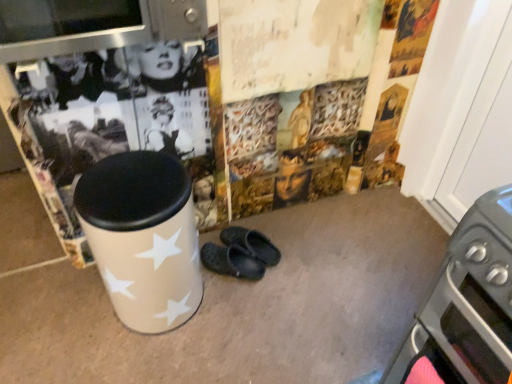
Question: From a real-world perspective, relative to white glossy trash can at center, is metallic gray oven at lower right vertically above or below?

Choices:
 (A) below
 (B) above

Answer: (B)

Question: From the image's perspective, is metallic gray oven at lower right located above or below white glossy trash can at center?

Choices:
 (A) above
 (B) below

Answer: (B)

Question: Based on their relative distances, which object is farther from the white glossy trash can at center?

Choices:
 (A) metallic stainless steel microwave at upper left
 (B) black rubber clogs at center
 (C) metallic gray oven at lower right

Answer: (C)

Question: Which object is positioned closest to the metallic gray oven at lower right?

Choices:
 (A) metallic stainless steel microwave at upper left
 (B) white glossy trash can at center
 (C) black rubber clogs at center

Answer: (B)